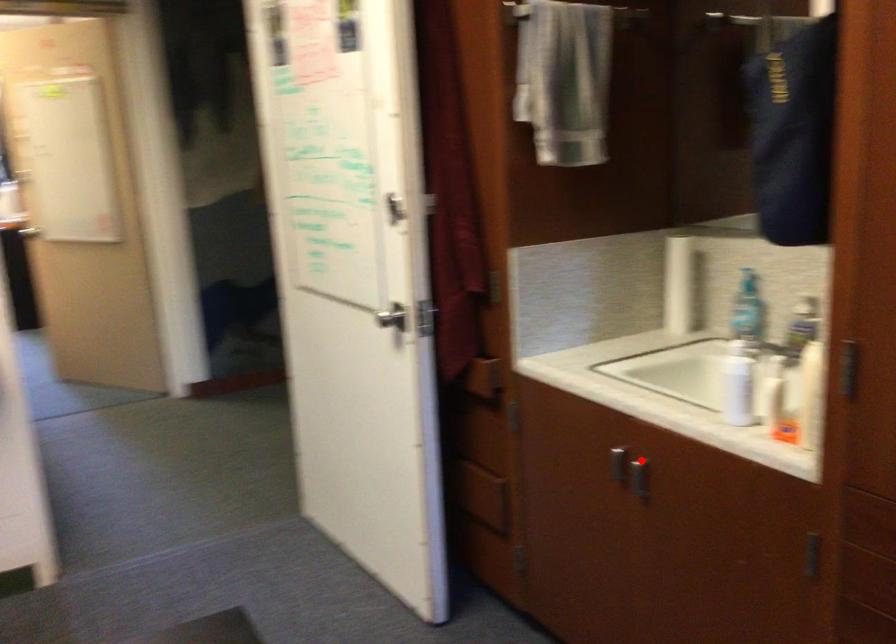
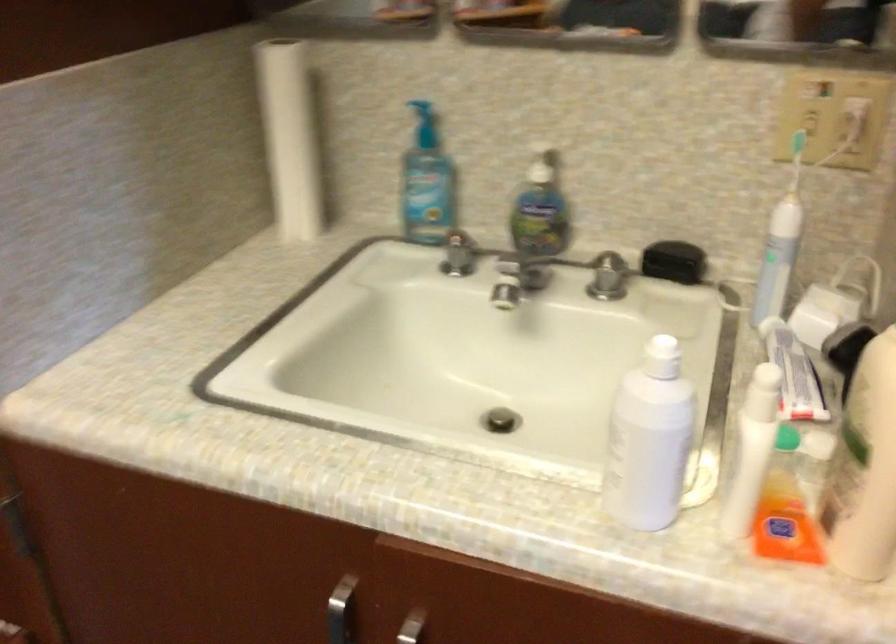
Where in the second image is the point corresponding to the highlighted location from the first image?

(411, 627)